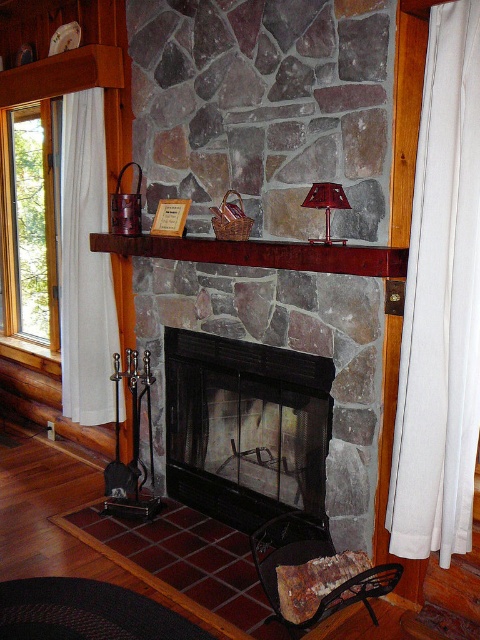
Does brown wooden mantle at center appear over shiny red glass lamp at center?

Incorrect, brown wooden mantle at center is not positioned above shiny red glass lamp at center.

Is point (346, 252) closer to camera compared to point (325, 230)?

Yes, point (346, 252) is closer to viewer.

Find the location of `brown wooden mantle at center`. brown wooden mantle at center is located at coordinates (260, 253).

Does point (88, 163) lie behind point (339, 241)?

Yes, point (88, 163) is farther from viewer.

Who is shorter, white sheer curtain at left or shiny red glass lamp at center?

Standing shorter between the two is shiny red glass lamp at center.

At what (x,y) coordinates should I click in order to perform the action: click on white sheer curtain at left. Please return your answer as a coordinate pair (x, y). The width and height of the screenshot is (480, 640). Looking at the image, I should click on (85, 264).

Does black glass fireplace at center appear on the left side of shiny red glass lamp at center?

Correct, you'll find black glass fireplace at center to the left of shiny red glass lamp at center.

Is black glass fireplace at center smaller than shiny red glass lamp at center?

No, black glass fireplace at center is not smaller than shiny red glass lamp at center.

Identify the location of black glass fireplace at center. coord(244,428).

Identify the location of black glass fireplace at center. (244, 428).